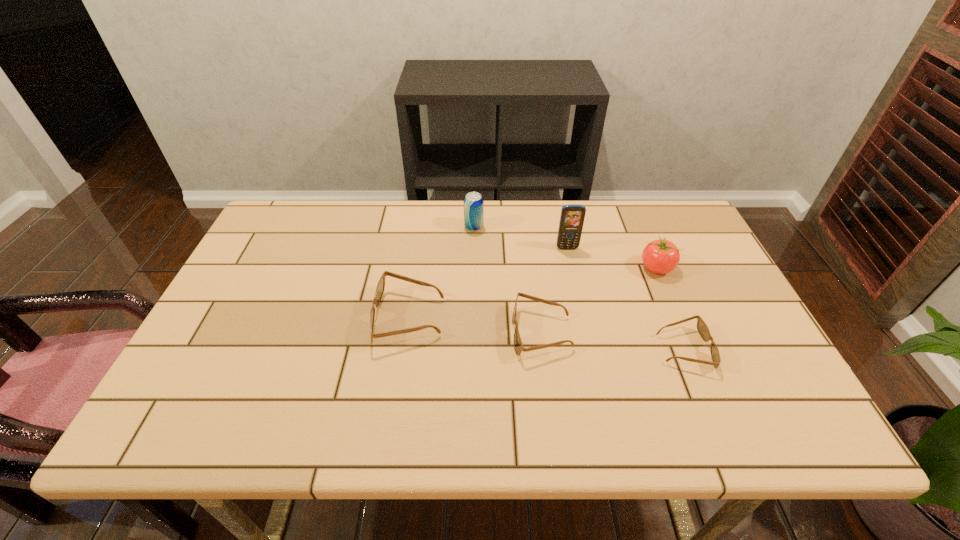
In the image, there is a desktop. Identify the location of free space at the left edge. coord(251,273).

Where is `free space at the right edge of the desktop`? This screenshot has height=540, width=960. free space at the right edge of the desktop is located at coordinates (689, 283).

Locate an element on the screen. blank area at the far right corner is located at coordinates (650, 200).

The height and width of the screenshot is (540, 960). Find the location of `free point between the third object from right to left and the second shortest sunglasses`. free point between the third object from right to left and the second shortest sunglasses is located at coordinates (555, 291).

Identify the location of vacant area that lies between the rightmost sunglasses and the cellular telephone. (625, 299).

The width and height of the screenshot is (960, 540). What are the coordinates of `blank region between the leftmost object and the third object from right to left` in the screenshot? It's located at (488, 283).

In order to click on unoccupied area between the leftmost sunglasses and the cellular telephone in this screenshot , I will do 488,283.

Where is `vacant space in between the beer can and the second sunglasses from right to left`? The height and width of the screenshot is (540, 960). vacant space in between the beer can and the second sunglasses from right to left is located at coordinates (508, 280).

Locate an element on the screen. This screenshot has width=960, height=540. free point between the rightmost sunglasses and the fifth tallest object is located at coordinates (612, 341).

Identify the location of free spot between the shortest sunglasses and the second shortest object. The image size is (960, 540). (612, 341).